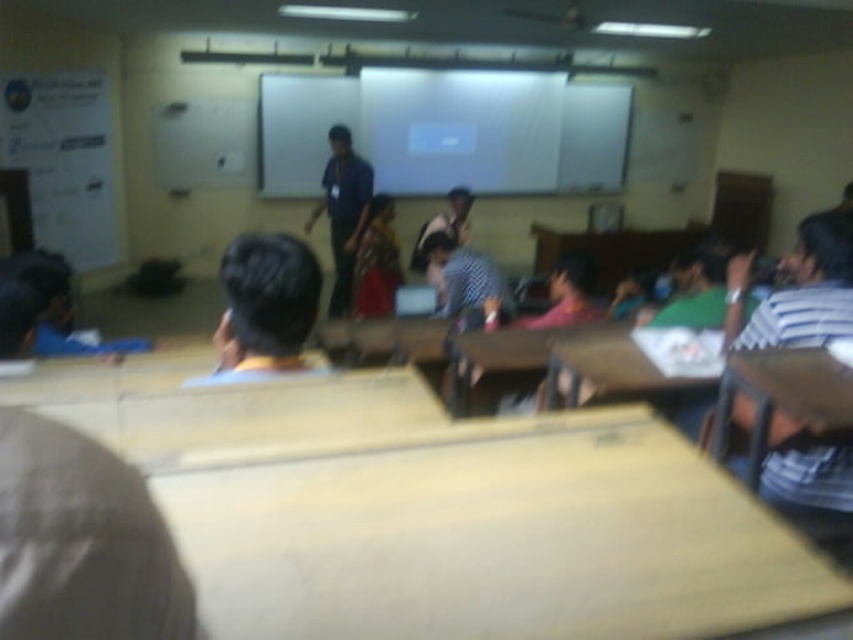
Question: Which object is farther from the camera taking this photo?

Choices:
 (A) white striped shirt at right
 (B) blue shirt at center

Answer: (B)

Question: Can you confirm if white striped shirt at right is positioned to the right of checkered fabric shirt at center?

Choices:
 (A) yes
 (B) no

Answer: (A)

Question: Is white striped shirt at right below blue shirt at center?

Choices:
 (A) yes
 (B) no

Answer: (A)

Question: In this image, where is white striped shirt at right located relative to checkered fabric shirt at center?

Choices:
 (A) left
 (B) right

Answer: (B)

Question: Among these objects, which one is farthest from the camera?

Choices:
 (A) white striped shirt at right
 (B) checkered fabric shirt at center
 (C) blue shirt at center

Answer: (C)

Question: Which object is the closest to the white striped shirt at right?

Choices:
 (A) blue shirt at center
 (B) checkered fabric shirt at center

Answer: (B)